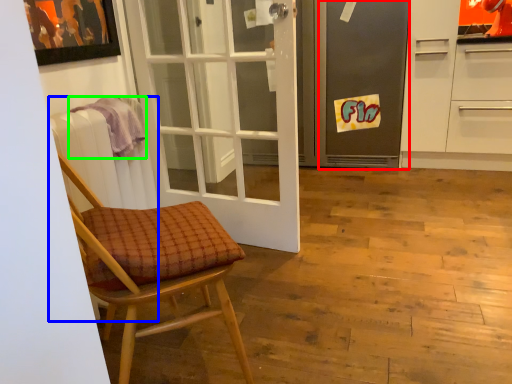
Question: Which object is positioned farthest from screen door (highlighted by a red box)? Select from radiator (highlighted by a blue box) and towel/napkin (highlighted by a green box).

Choices:
 (A) radiator
 (B) towel/napkin

Answer: (A)